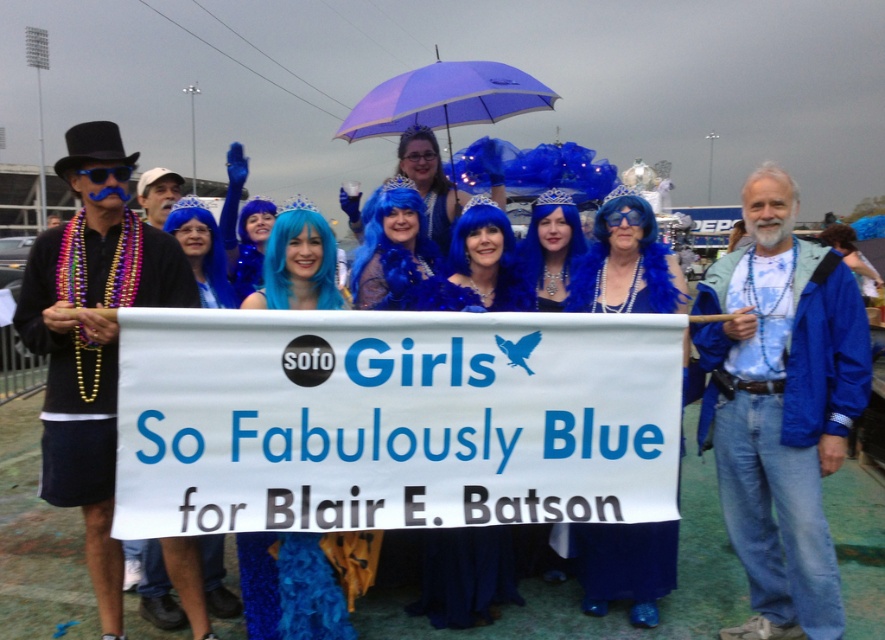
You are a photographer standing in front of the group. You want to take a photo that includes both the blue denim jacket at lower right and the purple fabric umbrella at upper center. Which object will appear larger in the photo?

The blue denim jacket at lower right will appear larger in the photo because it is closer to the viewer than the purple fabric umbrella at upper center.

You are a photographer at the event and need to capture a photo where both the matte black jacket at left and the purple fabric umbrella at upper center are visible. Given their sizes, which object should you position closer to the camera to ensure both are fully in frame?

The matte black jacket at left has a greater height compared to the purple fabric umbrella at upper center. To ensure both are fully visible, position the matte black jacket at left closer to the camera since it is taller and requires more space in the frame.

You are a photographer trying to capture a photo of the blue denim jacket at lower right and the matte black jacket at left. Which jacket is closer to you?

The blue denim jacket at lower right is closer to you because it is further to the viewer than the matte black jacket at left.